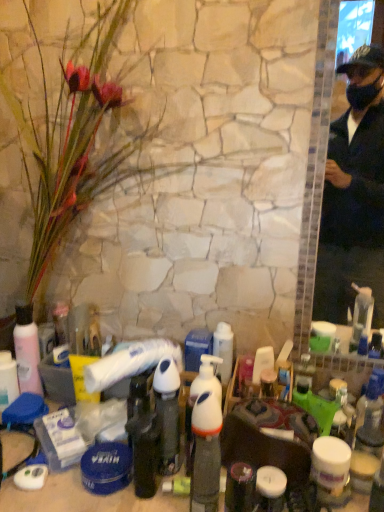
Question: From a real-world perspective, relative to pink matte lotion at lower left, which is the fourth bottle in right-to-left order, is white glossy pump bottle at center, the 1th bottle when ordered from right to left, vertically above or below?

Choices:
 (A) above
 (B) below

Answer: (B)

Question: In terms of size, does white glossy pump bottle at center, the first bottle from the front, appear bigger or smaller than pink matte lotion at lower left, which is the fourth bottle in right-to-left order?

Choices:
 (A) big
 (B) small

Answer: (B)

Question: Which is nearer to the silky pink petals at left?

Choices:
 (A) white pump bottle at center
 (B) pink matte lotion at lower left, placed as the 1th bottle when sorted from left to right
 (C) white glossy pump bottle at center, the first bottle from the front
 (D) white plastic pump bottle at center, the third bottle positioned from the back
 (E) translucent plastic bottle at center, which is the 3th bottle from right to left

Answer: (B)

Question: Considering the real-world distances, which object is farthest from the silky pink petals at left?

Choices:
 (A) white plastic pump bottle at center, the third bottle positioned from the back
 (B) translucent plastic bottle at center, the 3th bottle when ordered from front to back
 (C) pink matte lotion at lower left, placed as the 1th bottle when sorted from back to front
 (D) white pump bottle at center
 (E) white glossy pump bottle at center, the 1th bottle when ordered from right to left

Answer: (E)